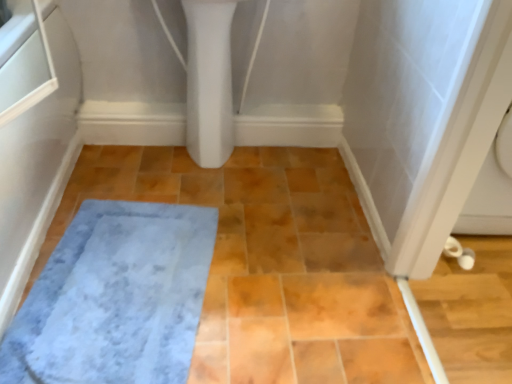
The width and height of the screenshot is (512, 384). I want to click on vacant space in front of white glossy bidet at upper center, so click(203, 186).